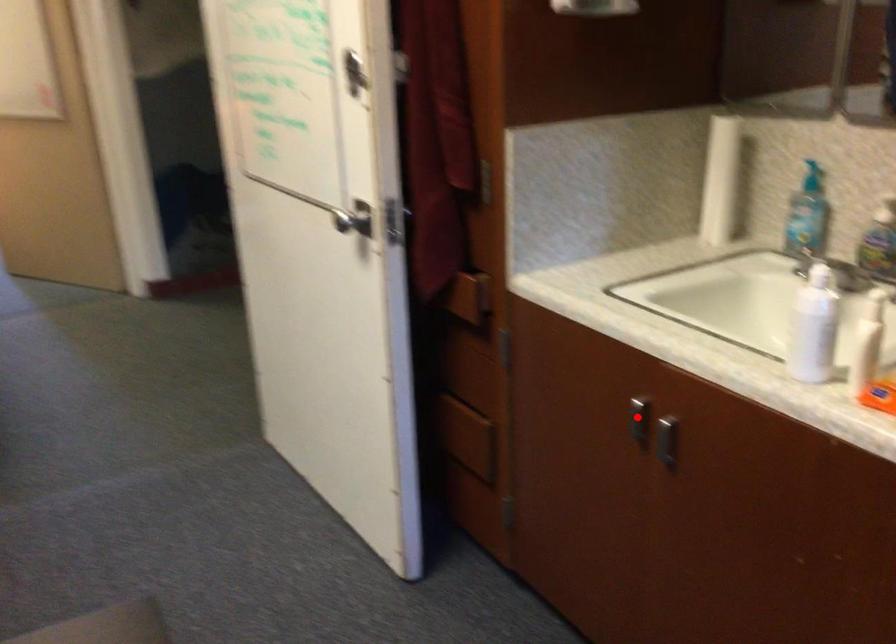
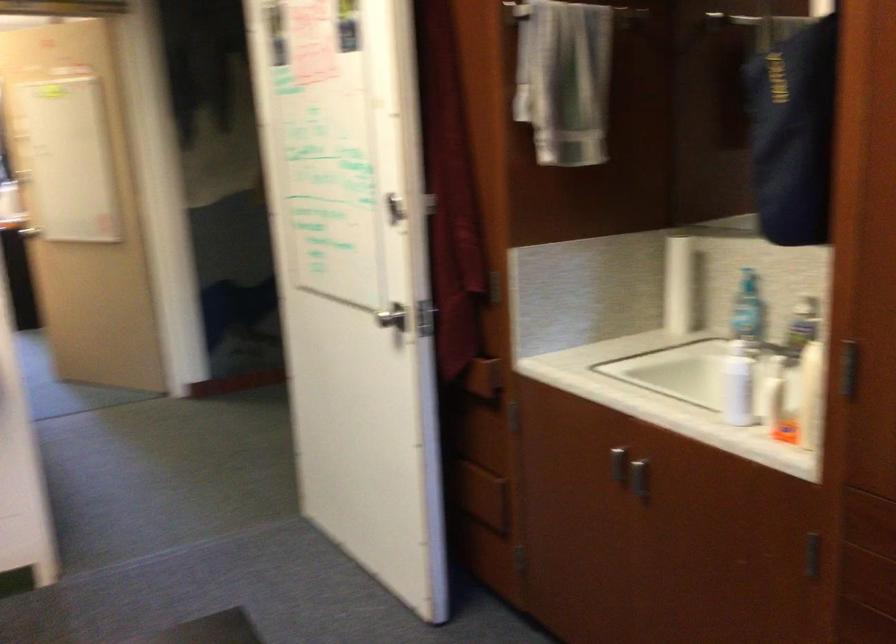
Locate, in the second image, the point that corresponds to the highlighted location in the first image.

(618, 464)